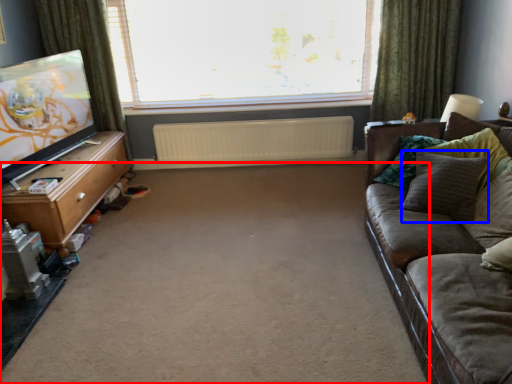
Question: Among these objects, which one is farthest to the camera, plain (highlighted by a red box) or pillow (highlighted by a blue box)?

Choices:
 (A) plain
 (B) pillow

Answer: (B)